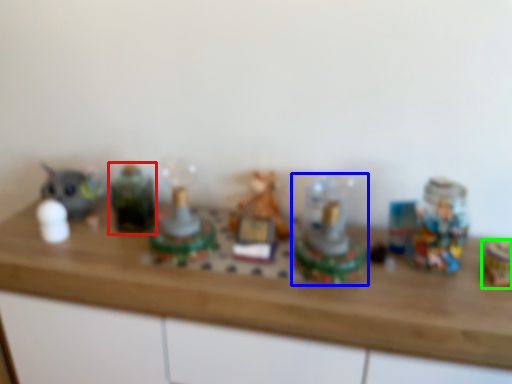
Question: Based on their relative distances, which object is farther from toy (highlighted by a red box)? Choose from toy (highlighted by a blue box) and toy (highlighted by a green box).

Choices:
 (A) toy
 (B) toy

Answer: (B)